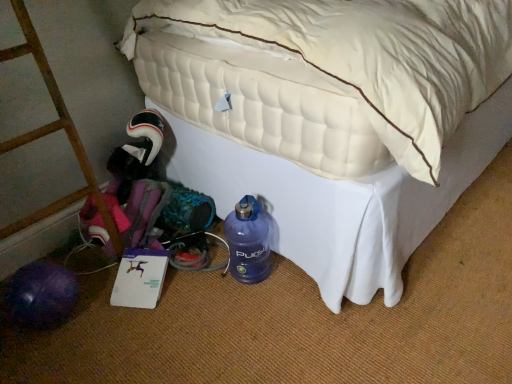
You are a GUI agent. You are given a task and a screenshot of the screen. Output one action in this format:
    pyautogui.click(x=<x>, y=<y>)
    Task: Click on the vacant area that is in front of blue matte water bottle at lower center
    The height and width of the screenshot is (384, 512).
    Given the screenshot: What is the action you would take?
    pyautogui.click(x=247, y=308)